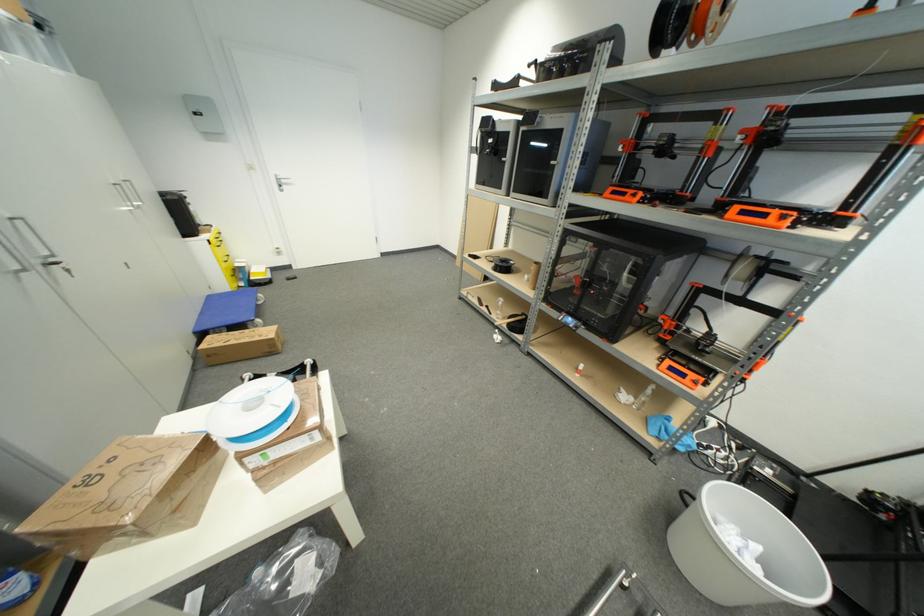
This screenshot has height=616, width=924. Identify the location of black bucket handle. (604, 593).